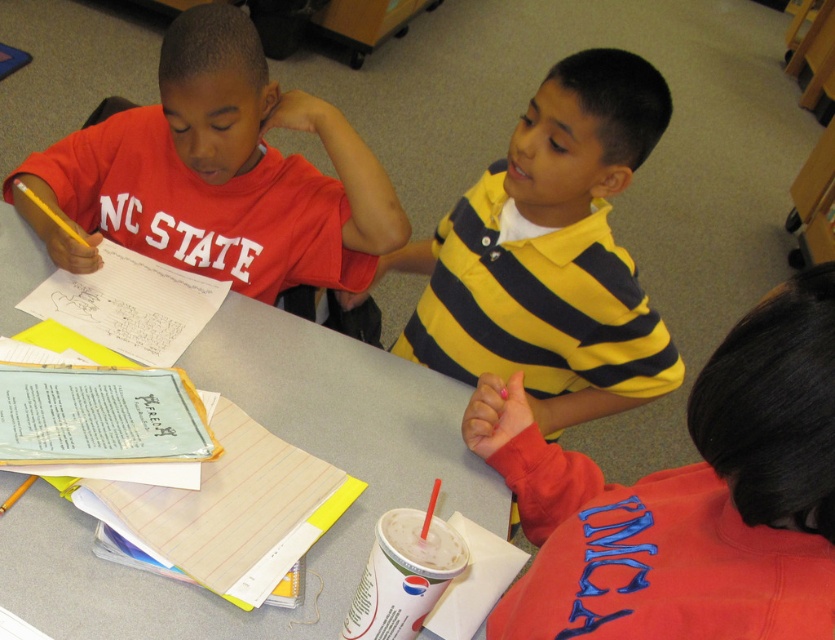
Question: Can you confirm if matte red sweatshirt at lower right is positioned above yellow striped polo shirt at center?

Choices:
 (A) no
 (B) yes

Answer: (A)

Question: Which point appears closest to the camera in this image?

Choices:
 (A) (639, 381)
 (B) (719, 614)
 (C) (296, 198)
 (D) (90, 636)

Answer: (B)

Question: Is matte red sweatshirt at lower right smaller than yellow striped polo shirt at center?

Choices:
 (A) no
 (B) yes

Answer: (B)

Question: Is yellow striped polo shirt at center positioned before matte red shirt at center?

Choices:
 (A) no
 (B) yes

Answer: (B)

Question: Which point is closer to the camera taking this photo?

Choices:
 (A) (454, 307)
 (B) (358, 356)
 (C) (332, 160)

Answer: (C)

Question: Considering the real-world distances, which object is closest to the white paper at upper left?

Choices:
 (A) matte red shirt at center
 (B) yellow striped polo shirt at center

Answer: (A)